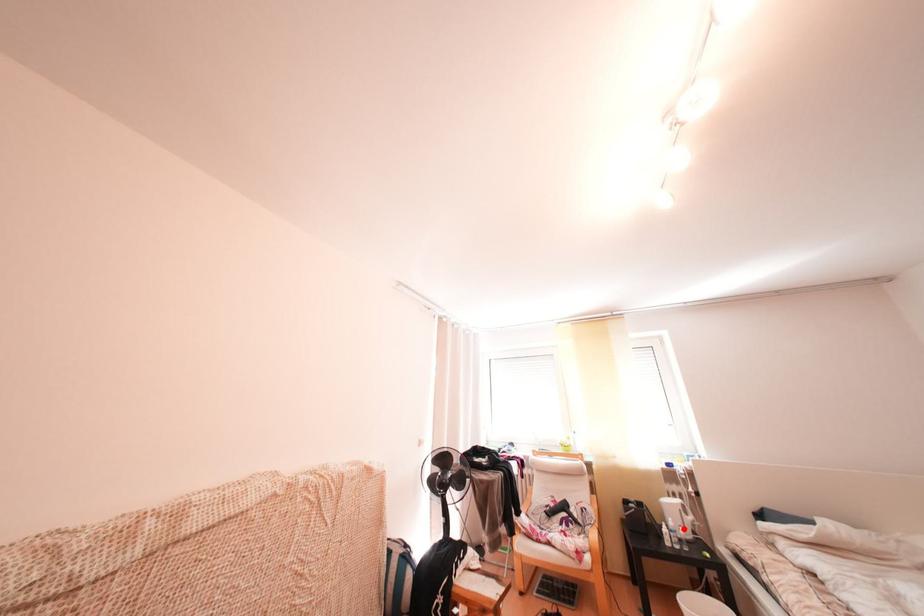
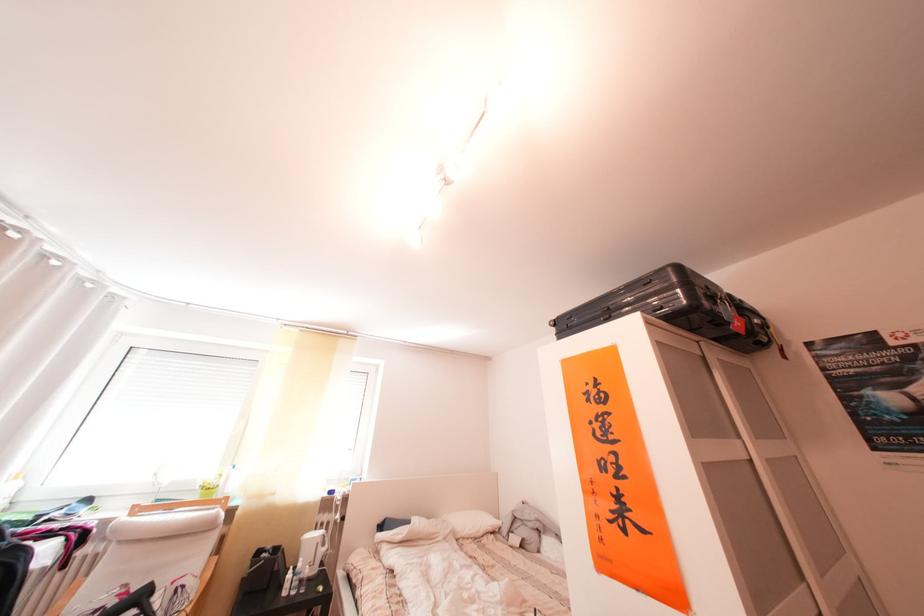
In the second image, find the point that corresponds to the highlighted location in the first image.

(312, 570)